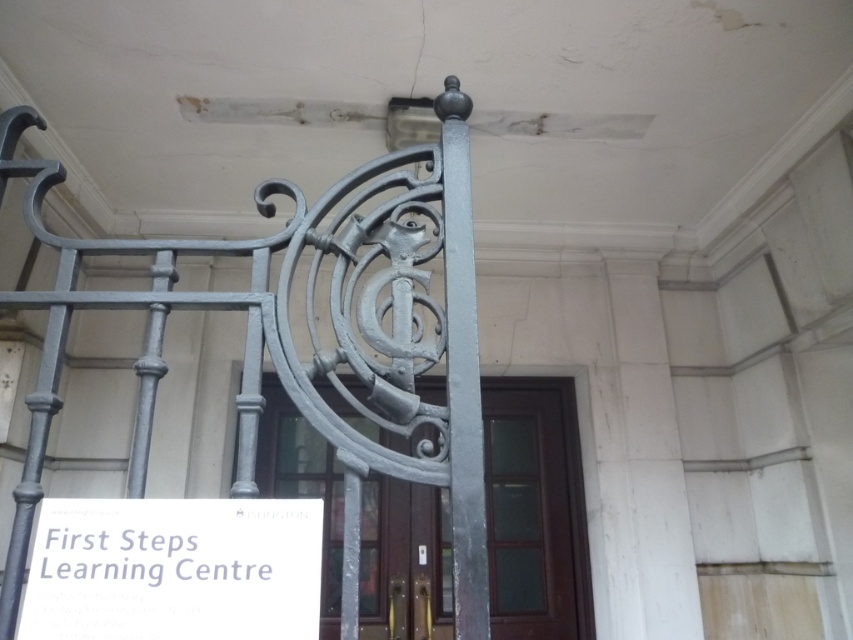
Which is above, polished wood door at center or white paper sign at lower left?

white paper sign at lower left

Is polished wood door at center bigger than white paper sign at lower left?

Yes.

Locate an element on the screen. The width and height of the screenshot is (853, 640). polished wood door at center is located at coordinates (535, 509).

The height and width of the screenshot is (640, 853). In order to click on polished wood door at center in this screenshot , I will do `click(535, 509)`.

Can you confirm if white paper sign at lower left is positioned to the right of gray metal pole at center?

No, white paper sign at lower left is not to the right of gray metal pole at center.

From the picture: Who is more forward, [102,628] or [463,499]?

Point [102,628]

Is point (308, 531) positioned before point (473, 467)?

Yes, it is in front of point (473, 467).

Locate an element on the screen. The height and width of the screenshot is (640, 853). white paper sign at lower left is located at coordinates (173, 570).

Who is shorter, matte gray metal gate at center or white paper sign at lower left?

Standing shorter between the two is white paper sign at lower left.

Identify the location of matte gray metal gate at center. (309, 339).

Image resolution: width=853 pixels, height=640 pixels. Identify the location of matte gray metal gate at center. (309, 339).